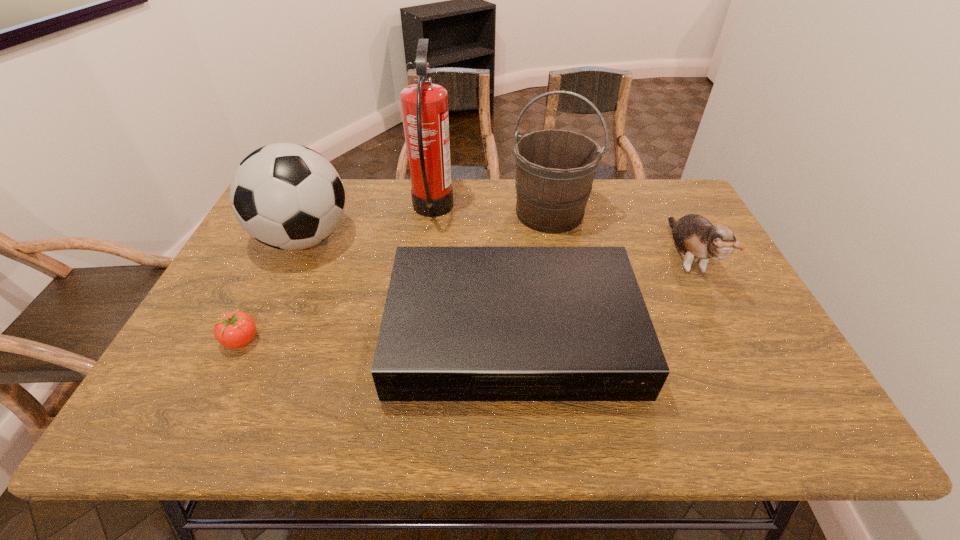
In order to click on free space between the third tallest object and the bucket in this screenshot , I will do `click(427, 226)`.

Where is `object that is the closest to the rightmost object`? The image size is (960, 540). object that is the closest to the rightmost object is located at coordinates (460, 323).

Locate which object ranks third in proximity to the bucket. Please provide its 2D coordinates. Your answer should be formatted as a tuple, i.e. [(x, y)], where the tuple contains the x and y coordinates of a point satisfying the conditions above.

[(696, 238)]

Where is `vacant space that satisfies the following two spatial constraints: 1. on the front-facing side of the bucket; 2. on the left side of the fire extinguisher`? vacant space that satisfies the following two spatial constraints: 1. on the front-facing side of the bucket; 2. on the left side of the fire extinguisher is located at coordinates (432, 213).

Identify the location of blank area in the image that satisfies the following two spatial constraints: 1. on the front-facing side of the bucket; 2. on the left side of the fire extinguisher. (432, 213).